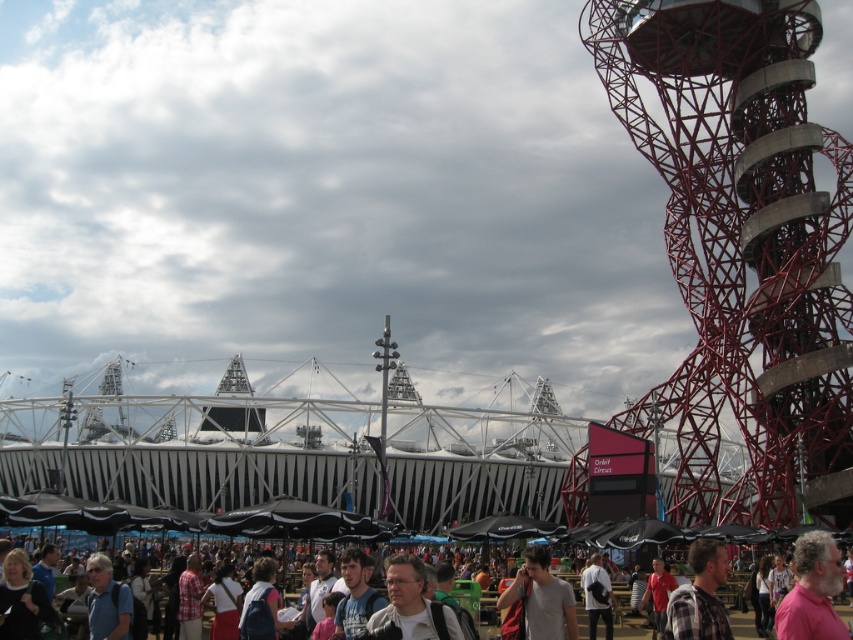
You are at the event and want to take a photo of the crowd. You notice the pink matte shirt at center and the gray fabric backpack at center. Which object should you focus on to ensure both are visible in the frame?

You should focus on the pink matte shirt at center because it is taller than the gray fabric backpack at center, so positioning the camera to include its height will also capture the backpack.

You are a photographer standing at the camera position and want to take a photo of the red metal structure at right. Considering the distance, will you need a telephoto lens to capture the entire structure in frame?

The red metal structure at right is 98.83 meters away from the camera. A telephoto lens is necessary to capture the entire structure in frame at that distance.